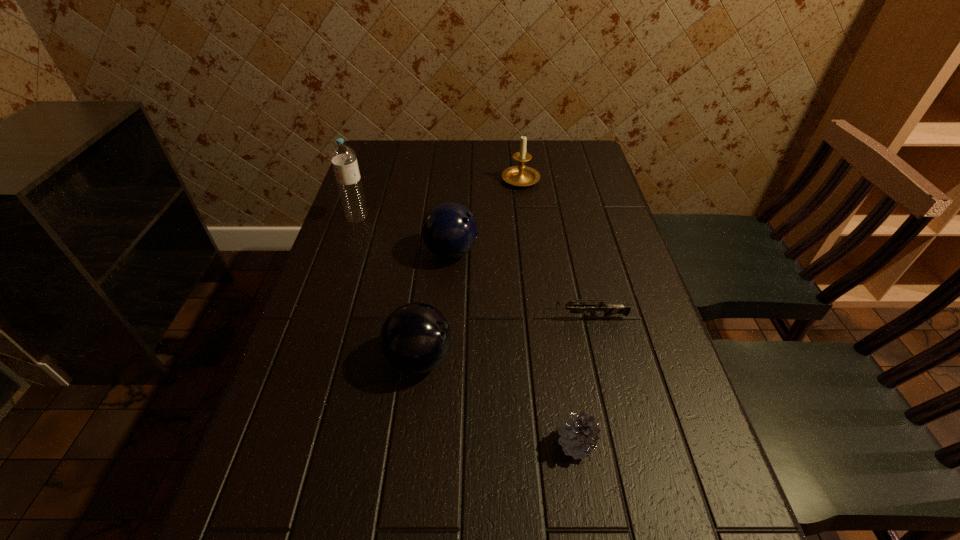
Where is `object located in the left edge section of the desktop`? The image size is (960, 540). object located in the left edge section of the desktop is located at coordinates (343, 157).

The width and height of the screenshot is (960, 540). I want to click on object that is at the right edge, so click(609, 309).

Where is `free space at the far edge`? free space at the far edge is located at coordinates (548, 163).

Where is `free region at the left edge`? free region at the left edge is located at coordinates (364, 238).

The width and height of the screenshot is (960, 540). In the image, there is a desktop. Identify the location of blank space at the right edge. (604, 395).

Where is `blank space at the far left corner of the desktop`? The height and width of the screenshot is (540, 960). blank space at the far left corner of the desktop is located at coordinates (393, 161).

This screenshot has width=960, height=540. Identify the location of vacant area at the far right corner of the desktop. click(596, 155).

You are a GUI agent. You are given a task and a screenshot of the screen. Output one action in this format:
    pyautogui.click(x=<x>, y=<y>)
    Task: Click on the free space between the nearer bowling ball and the farthest object
    The image size is (960, 540).
    Given the screenshot: What is the action you would take?
    pyautogui.click(x=470, y=268)

At what (x,y) coordinates should I click in order to perform the action: click on vacant region between the fifth farthest object and the nearest object. Please return your answer as a coordinate pair (x, y). The image size is (960, 540). Looking at the image, I should click on click(498, 401).

Locate an element on the screen. Image resolution: width=960 pixels, height=540 pixels. free space between the gun and the farthest object is located at coordinates (553, 248).